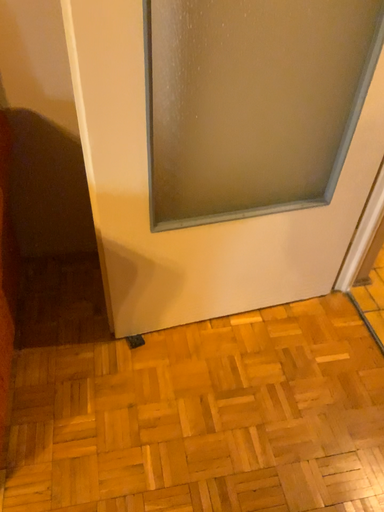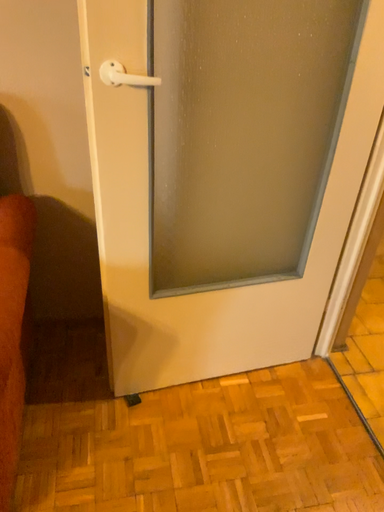
Question: How did the camera likely rotate when shooting the video?

Choices:
 (A) rotated downward
 (B) rotated upward

Answer: (B)